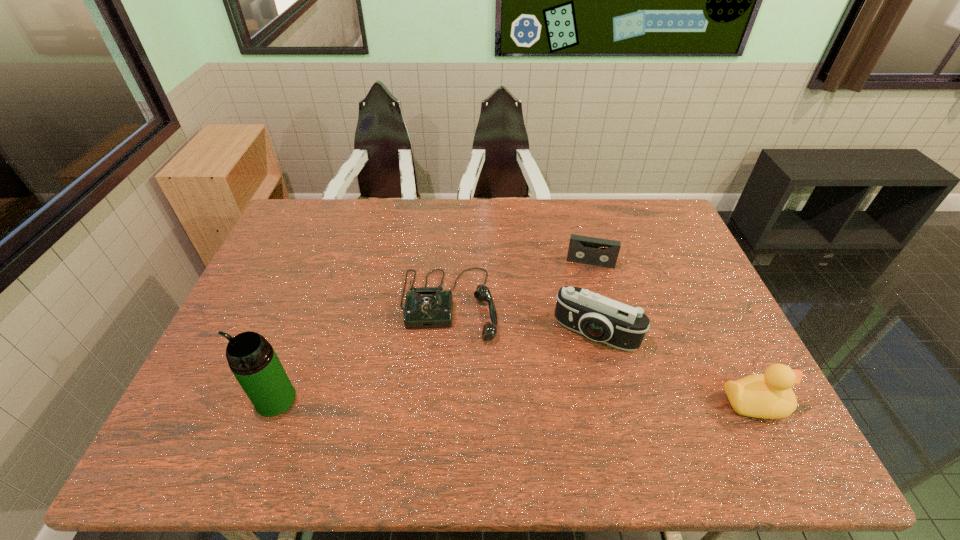
Identify the location of blank space at the far right corner of the desktop. Image resolution: width=960 pixels, height=540 pixels. (644, 203).

Identify the location of free area in between the fourth object from right to left and the duck. The image size is (960, 540). click(602, 354).

At what (x,y) coordinates should I click in order to perform the action: click on vacant region between the leftmost object and the camera. Please return your answer as a coordinate pair (x, y). Looking at the image, I should click on (436, 366).

The height and width of the screenshot is (540, 960). Identify the location of empty location between the leftmost object and the fourth object from right to left. (362, 352).

Locate an element on the screen. free space that is in between the second shortest object and the shortest object is located at coordinates (519, 284).

Where is `empty location between the telephone and the shortest object`? empty location between the telephone and the shortest object is located at coordinates (519, 284).

Locate an element on the screen. The width and height of the screenshot is (960, 540). free area in between the camera and the rightmost object is located at coordinates (675, 368).

Identify the location of free space between the rightmost object and the telephone. This screenshot has height=540, width=960. (602, 354).

You are a GUI agent. You are given a task and a screenshot of the screen. Output one action in this format:
    pyautogui.click(x=<x>, y=<y>)
    Task: Click on the vacant area that lies between the shortest object and the thermos bottle
    The width and height of the screenshot is (960, 540).
    Given the screenshot: What is the action you would take?
    pyautogui.click(x=433, y=331)

Locate an element on the screen. the third closest object relative to the leftmost object is located at coordinates (582, 249).